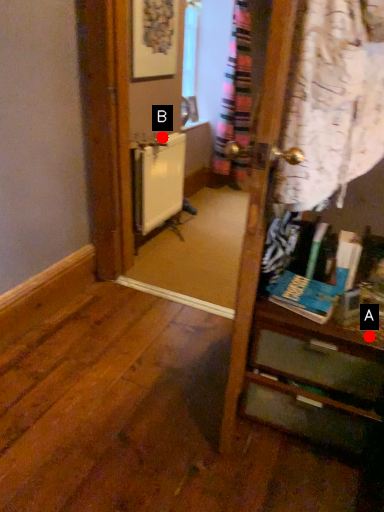
Question: Two points are circled on the image, labeled by A and B beside each circle. Which point is closer to the camera?

Choices:
 (A) A is closer
 (B) B is closer

Answer: (A)